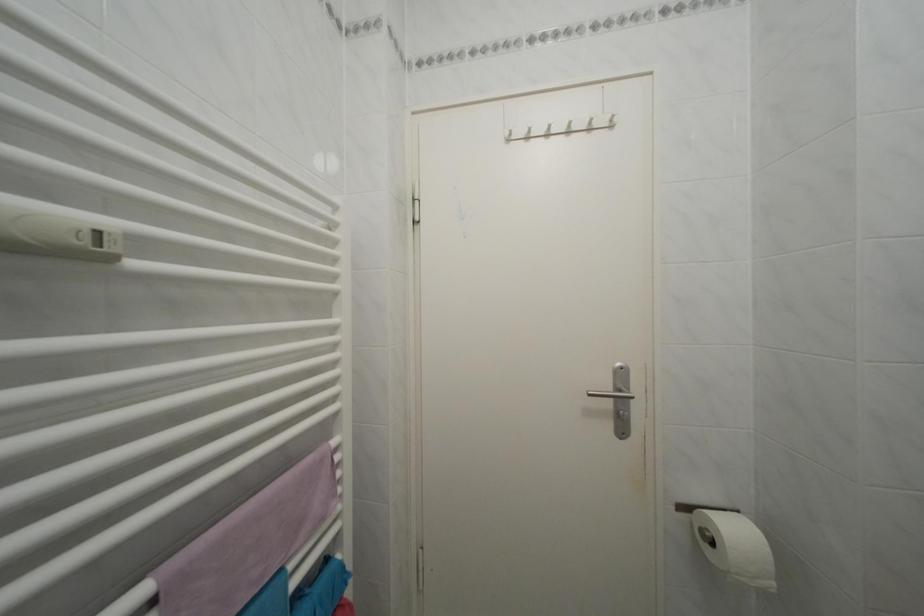
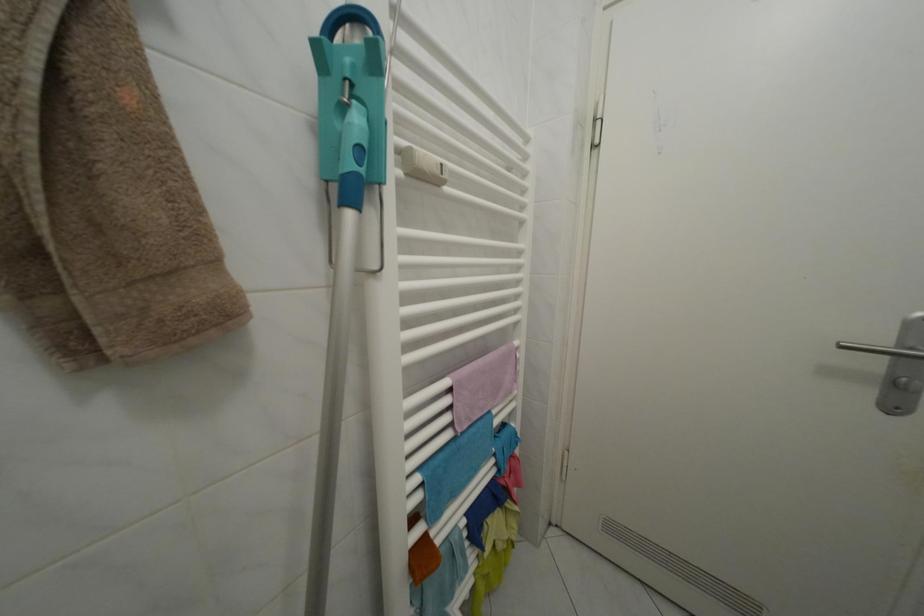
Find the pixel in the second image that matches point 617,395 in the first image.

(892, 350)